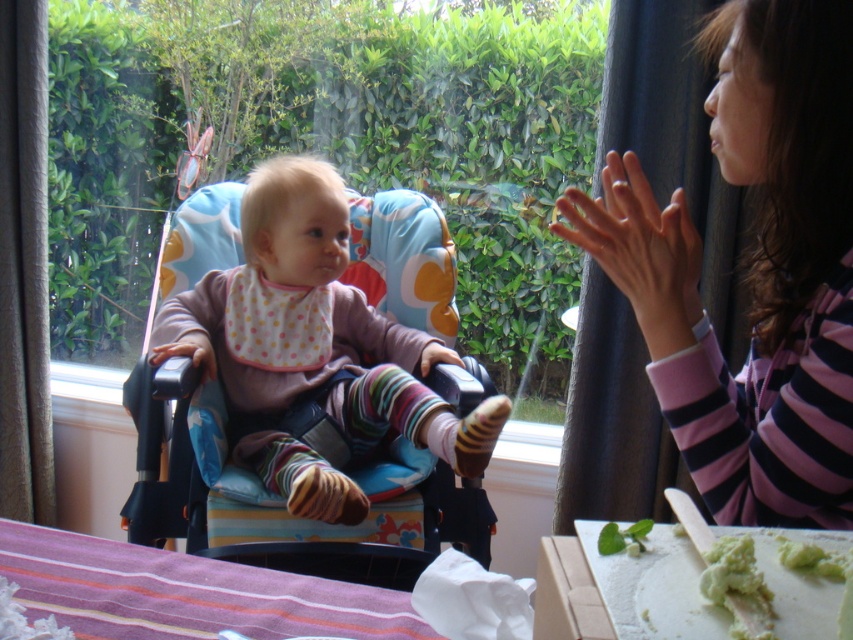
Question: Is purple striped fabric at lower left behind white plastic cutting board at lower right?

Choices:
 (A) no
 (B) yes

Answer: (B)

Question: Can you confirm if white plastic cutting board at lower right is positioned to the right of green mashed potato at lower right?

Choices:
 (A) no
 (B) yes

Answer: (B)

Question: Which of the following is the closest to the observer?

Choices:
 (A) white plastic cutting board at lower right
 (B) green leafy vegetable at lower center
 (C) purple striped fabric at lower left

Answer: (A)

Question: Which of these objects is positioned farthest from the green creamy food at lower right?

Choices:
 (A) striped fabric shirt at right
 (B) matte pink bib at center
 (C) green leafy vegetable at lower center

Answer: (B)

Question: Estimate the real-world distances between objects in this image. Which object is farther from the green mashed potato at lower right?

Choices:
 (A) matte pink bib at center
 (B) green creamy food at lower right
 (C) purple striped fabric at lower left
 (D) green leafy vegetable at lower center

Answer: (A)

Question: Observing the image, what is the correct spatial positioning of striped fabric shirt at right in reference to white plastic cutting board at lower right?

Choices:
 (A) above
 (B) below

Answer: (A)